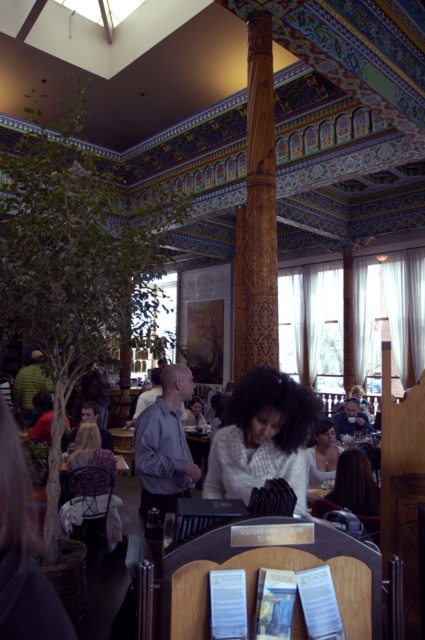
You are sitting in the plaid fabric chair at lower left and want to hand a napkin to someone wearing the smooth white blouse at center. Can you reach them without leaving your seat?

The plaid fabric chair at lower left is closer to the viewer than the smooth white blouse at center, so you can reach them without leaving your seat.